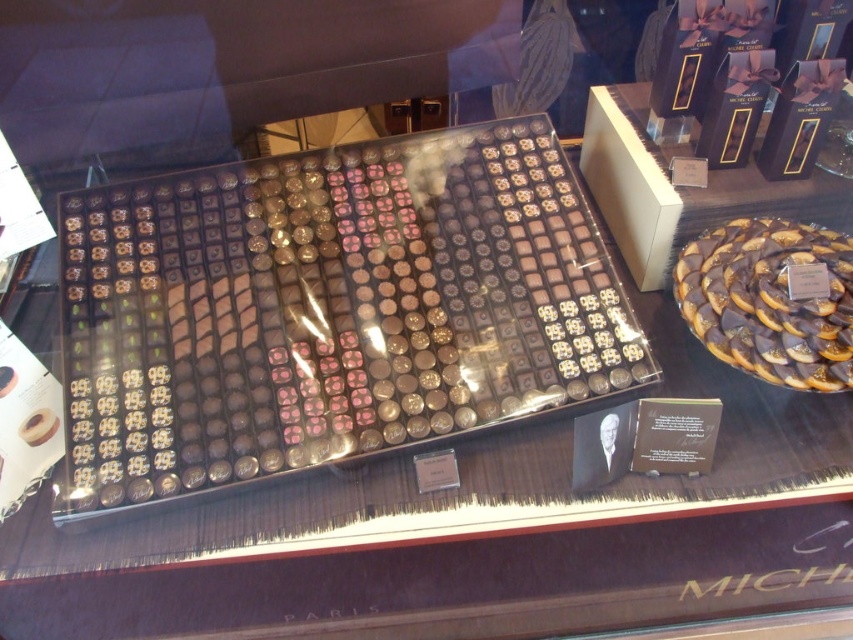
Question: Does shiny gold chocolate at center have a larger size compared to chocolate-coated cookie at center-right?

Choices:
 (A) no
 (B) yes

Answer: (B)

Question: Can you confirm if shiny gold chocolate at center is positioned above chocolate-coated cookie at center-right?

Choices:
 (A) no
 (B) yes

Answer: (B)

Question: Which point is farther from the camera taking this photo?

Choices:
 (A) (799, 332)
 (B) (440, 252)

Answer: (B)

Question: Is the position of shiny gold chocolate at center more distant than that of chocolate-coated cookie at center-right?

Choices:
 (A) yes
 (B) no

Answer: (B)

Question: Which point appears closest to the camera in this image?

Choices:
 (A) tap(802, 250)
 (B) tap(229, 396)

Answer: (B)